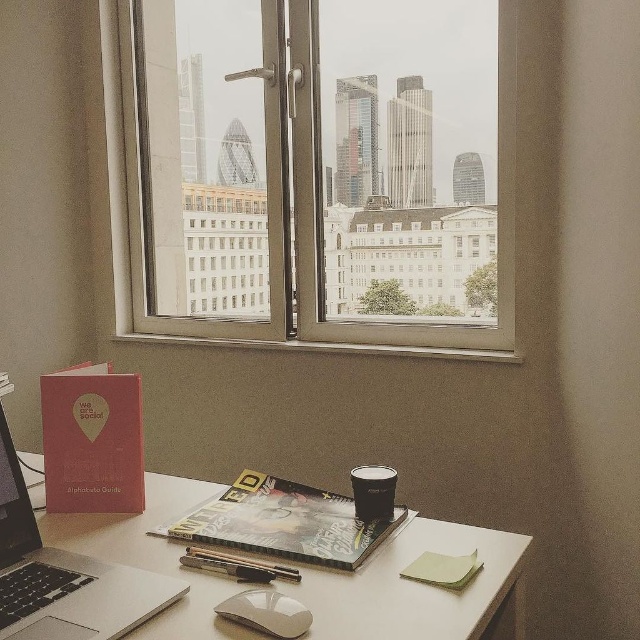
Based on the photo, does white glossy table at lower center have a greater height compared to black matte coffee cup at center?

Yes.

The height and width of the screenshot is (640, 640). What do you see at coordinates (419, 588) in the screenshot? I see `white glossy table at lower center` at bounding box center [419, 588].

What are the coordinates of `white glossy table at lower center` in the screenshot? It's located at (419, 588).

Who is more forward, (19,568) or (184,552)?

Positioned in front is point (19,568).

Can you confirm if silver metallic laptop at lower left is positioned to the right of metallic silver pen at center?

Incorrect, silver metallic laptop at lower left is not on the right side of metallic silver pen at center.

In order to click on silver metallic laptop at lower left in this screenshot , I will do pyautogui.click(x=64, y=576).

Is point (280, 625) closer to viewer compared to point (266, 573)?

That is True.

Is point (248, 621) positioned behind point (230, 554)?

No.

This screenshot has height=640, width=640. I want to click on white glossy mouse at center, so click(x=266, y=612).